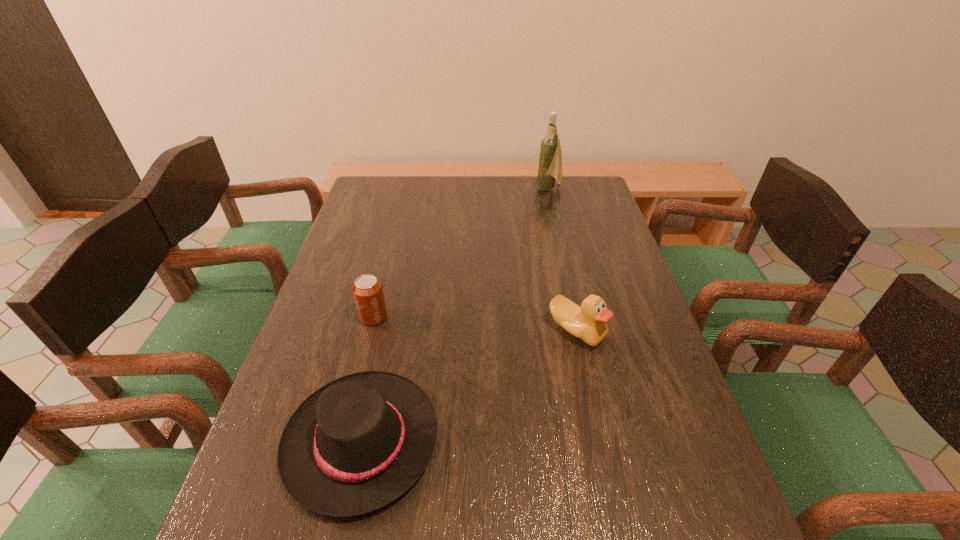
Where is `free location located 0.400m on the back of the nearest object`? free location located 0.400m on the back of the nearest object is located at coordinates (398, 267).

I want to click on object positioned at the far edge, so click(550, 159).

The image size is (960, 540). Identify the location of can located at the left edge. (367, 290).

At what (x,y) coordinates should I click in order to perform the action: click on dress hat that is at the left edge. Please return your answer as a coordinate pair (x, y). This screenshot has height=540, width=960. Looking at the image, I should click on (356, 444).

Where is `wine bottle situated at the right edge`? Image resolution: width=960 pixels, height=540 pixels. wine bottle situated at the right edge is located at coordinates (550, 159).

You are a GUI agent. You are given a task and a screenshot of the screen. Output one action in this format:
    pyautogui.click(x=<x>, y=<y>)
    Task: Click on the duck at the right edge
    Image resolution: width=960 pixels, height=540 pixels.
    Given the screenshot: What is the action you would take?
    pyautogui.click(x=588, y=322)

The height and width of the screenshot is (540, 960). Identify the location of object that is at the far right corner. (550, 159).

Find the location of `blank space at the far edge of the desktop`. blank space at the far edge of the desktop is located at coordinates (506, 188).

Where is `vacant space at the left edge of the desktop`? The image size is (960, 540). vacant space at the left edge of the desktop is located at coordinates (346, 225).

The height and width of the screenshot is (540, 960). Find the location of `vacant space at the right edge`. vacant space at the right edge is located at coordinates (654, 451).